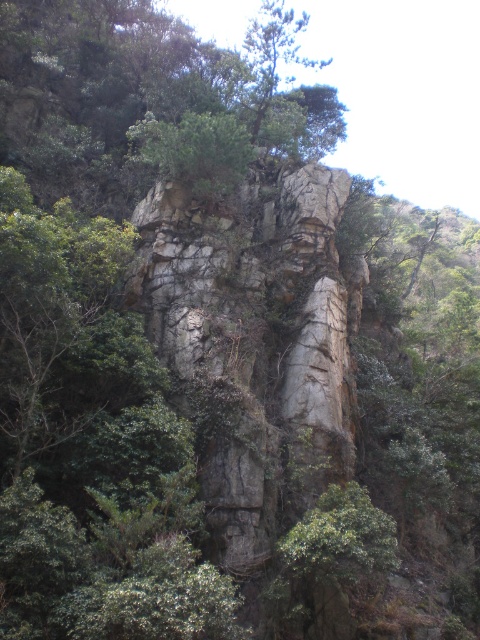
Question: Does rocky cliff at center have a larger size compared to green leafy tree at upper center?

Choices:
 (A) yes
 (B) no

Answer: (B)

Question: Which point is closer to the camera taking this photo?

Choices:
 (A) (282, 12)
 (B) (175, 301)

Answer: (B)

Question: Which of the following is the farthest from the observer?

Choices:
 (A) (186, 296)
 (B) (287, 80)

Answer: (B)

Question: Is rocky cliff at center to the left of green leafy tree at upper center from the viewer's perspective?

Choices:
 (A) no
 (B) yes

Answer: (B)

Question: Where is rocky cliff at center located in relation to green leafy tree at upper center in the image?

Choices:
 (A) above
 (B) below

Answer: (B)